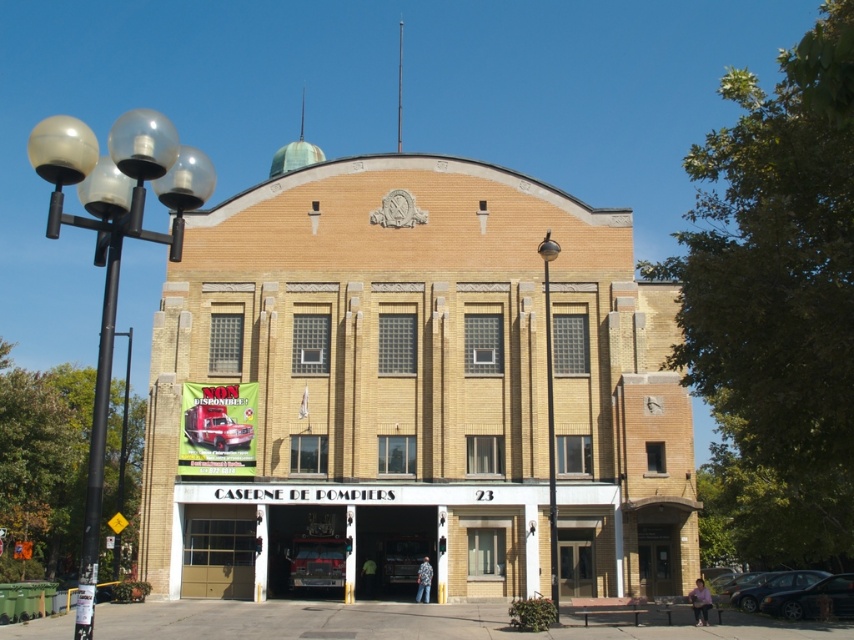
You are a delivery driver who needs to park your vehicle in the parking lot near the Caserne de Pompiers 23. You see a shiny black sedan at lower right and a shiny black car at lower right. Which one is more to the right?

The shiny black sedan at lower right is positioned on the right side of shiny black car at lower right, so the shiny black sedan at lower right is more to the right.

You are standing at the entrance of the fire station. You need to locate the yellow brick building at center. According to the coordinates provided, where exactly is it positioned?

The yellow brick building at center is located at point (x=417, y=392).

You are a delivery driver who needs to park your van, which is 20 feet long, between the shiny black sedan at lower right and the shiny black car at lower right. Can you fit your van in the space between them without moving either vehicle?

The distance between the shiny black sedan at lower right and the shiny black car at lower right is 44.52 feet. Since your van is only 20 feet long, there is sufficient space to park it between them without moving either vehicle.